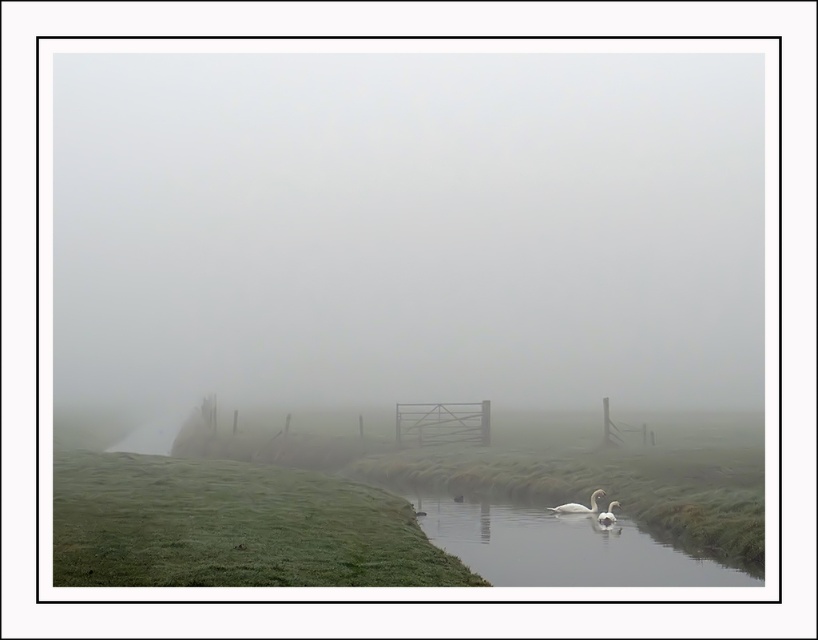
Measure the distance between point (100, 524) and camera.

32.95 feet

Which is behind, point (162, 472) or point (612, 506)?

The point (162, 472) is more distant.

What do you see at coordinates (232, 525) in the screenshot? This screenshot has width=818, height=640. I see `green grassy hillside at lower left` at bounding box center [232, 525].

Find the location of a particular element. This screenshot has height=640, width=818. green grassy hillside at lower left is located at coordinates tap(232, 525).

Between point (488, 545) and point (563, 506), which one is positioned in front?

Point (488, 545) is more forward.

Between point (682, 582) and point (556, 508), which one is positioned behind?

The point (556, 508) is behind.

What do you see at coordinates (558, 545) in the screenshot? This screenshot has height=640, width=818. I see `clear water at center` at bounding box center [558, 545].

This screenshot has height=640, width=818. I want to click on clear water at center, so click(x=558, y=545).

Between foggy mist at center and white glossy swan at lower center, which one has more height?

With more height is foggy mist at center.

Is foggy mist at center positioned at the back of white glossy swan at lower center?

Yes.

Does point (488, 368) come behind point (600, 515)?

Yes, it is behind point (600, 515).

You are a GUI agent. You are given a task and a screenshot of the screen. Output one action in this format:
    pyautogui.click(x=<x>, y=<y>)
    Task: Click on the foggy mist at center
    Image resolution: width=818 pixels, height=640 pixels.
    Given the screenshot: What is the action you would take?
    pyautogui.click(x=407, y=230)